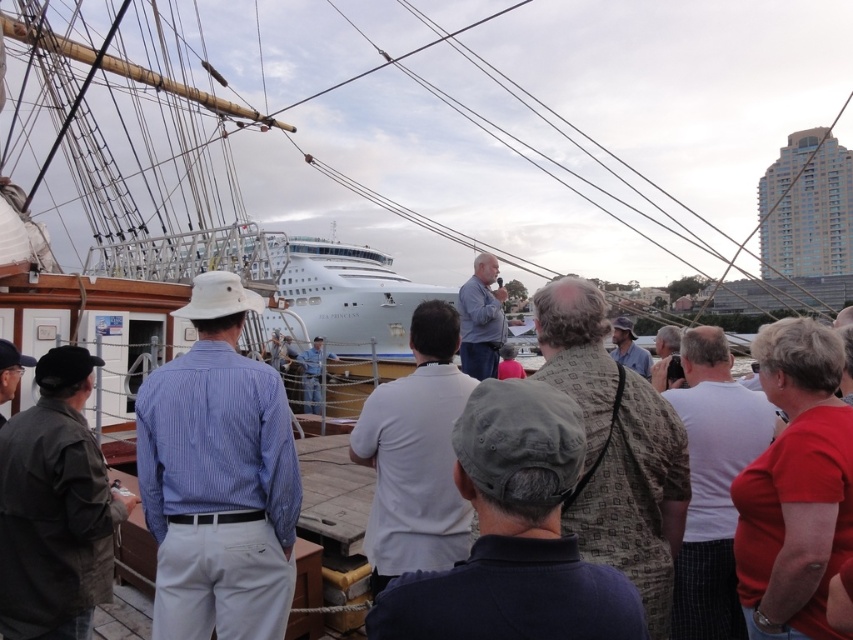
Is red matte shirt at lower right further to camera compared to light brown leather jacket at center?

No, it is in front of light brown leather jacket at center.

Does red matte shirt at lower right have a smaller size compared to light brown leather jacket at center?

No, red matte shirt at lower right is not smaller than light brown leather jacket at center.

Is point (733, 480) farther from camera compared to point (631, 340)?

No.

Locate an element on the screen. red matte shirt at lower right is located at coordinates (795, 486).

Does dark gray fabric cap at center have a smaller size compared to blue shirt at center?

Incorrect, dark gray fabric cap at center is not smaller in size than blue shirt at center.

Is dark gray fabric cap at center taller than blue shirt at center?

No, dark gray fabric cap at center is not taller than blue shirt at center.

Does point (514, 387) come farther from viewer compared to point (483, 268)?

No, it is in front of (483, 268).

You are a GUI agent. You are given a task and a screenshot of the screen. Output one action in this format:
    pyautogui.click(x=<x>, y=<y>)
    Task: Click on the dark gray fabric cap at center
    Image resolution: width=853 pixels, height=640 pixels.
    Given the screenshot: What is the action you would take?
    pyautogui.click(x=514, y=534)

Between camouflage-patterned shirt at center and light blue uniform at center, which one appears on the left side from the viewer's perspective?

Positioned to the left is light blue uniform at center.

Between point (589, 285) and point (314, 337), which one is positioned in front?

Point (589, 285)

What do you see at coordinates (637, 499) in the screenshot?
I see `camouflage-patterned shirt at center` at bounding box center [637, 499].

At what (x,y) coordinates should I click in order to perform the action: click on camouflage-patterned shirt at center. Please return your answer as a coordinate pair (x, y). The height and width of the screenshot is (640, 853). Looking at the image, I should click on (637, 499).